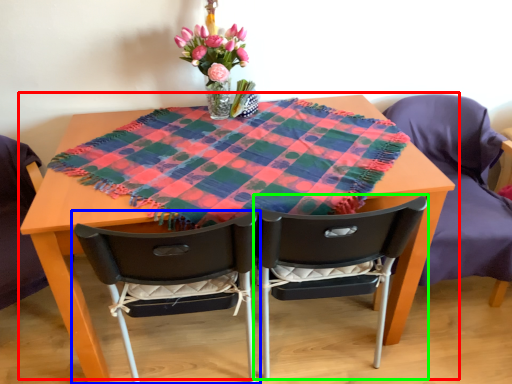
Question: Considering the real-world distances, which object is closest to table (highlighted by a red box)? chair (highlighted by a blue box) or chair (highlighted by a green box).

Choices:
 (A) chair
 (B) chair

Answer: (A)